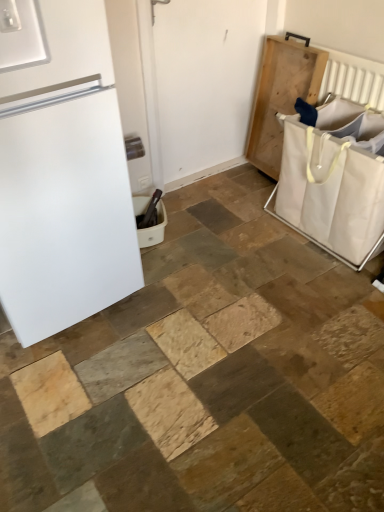
Question: From the image's perspective, is white plastic laundry basket at lower center, marked as the 2th laundry basket in a right-to-left arrangement, located above or below white canvas laundry basket at right, which ranks as the 1th laundry basket in right-to-left order?

Choices:
 (A) below
 (B) above

Answer: (A)

Question: In the image, is white plastic laundry basket at lower center, marked as the 2th laundry basket in a right-to-left arrangement, positioned in front of or behind white canvas laundry basket at right, which ranks as the 1th laundry basket in right-to-left order?

Choices:
 (A) behind
 (B) front

Answer: (A)

Question: Estimate the real-world distances between objects in this image. Which object is farther from the white matte refrigerator at left?

Choices:
 (A) white plastic laundry basket at lower center, marked as the 2th laundry basket in a right-to-left arrangement
 (B) natural wood tray at right
 (C) white canvas laundry basket at right, which ranks as the 1th laundry basket in right-to-left order
 (D) white matte screen door at center

Answer: (B)

Question: Which of these objects is positioned farthest from the natural wood tray at right?

Choices:
 (A) white matte refrigerator at left
 (B) white canvas laundry basket at right, which ranks as the 1th laundry basket in right-to-left order
 (C) white plastic laundry basket at lower center, placed as the 1th laundry basket when sorted from left to right
 (D) white matte screen door at center

Answer: (A)